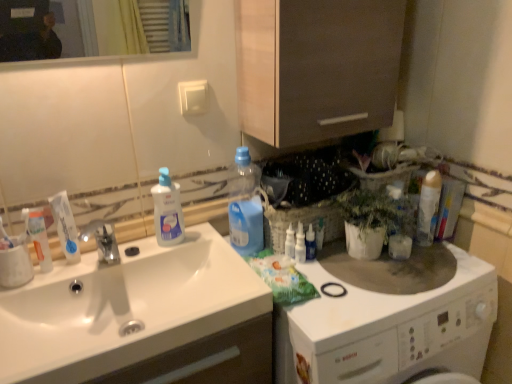
The width and height of the screenshot is (512, 384). I want to click on free space to the right of translucent plastic bottles at center, the 2th toiletry when ordered from left to right, so click(x=347, y=267).